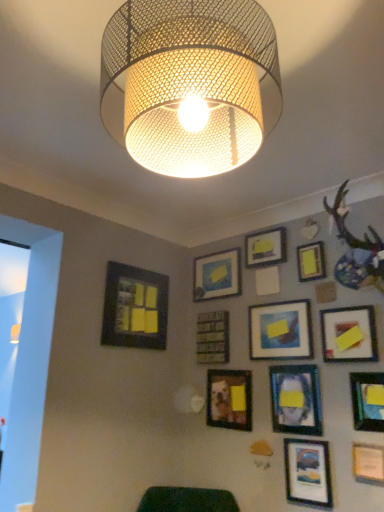
Question: Considering the relative sizes of yellow matte picture frame at upper right, acting as the 9th picture frame starting from the left, and metal mesh lampshade at upper center in the image provided, is yellow matte picture frame at upper right, acting as the 9th picture frame starting from the left, taller than metal mesh lampshade at upper center?

Choices:
 (A) yes
 (B) no

Answer: (B)

Question: Considering the relative positions of yellow matte picture frame at upper right, arranged as the fourth picture frame when viewed from the right, and metal mesh lampshade at upper center in the image provided, is yellow matte picture frame at upper right, arranged as the fourth picture frame when viewed from the right, to the left of metal mesh lampshade at upper center from the viewer's perspective?

Choices:
 (A) yes
 (B) no

Answer: (B)

Question: Is yellow matte picture frame at upper right, acting as the 9th picture frame starting from the left, completely or partially outside of metal mesh lampshade at upper center?

Choices:
 (A) yes
 (B) no

Answer: (A)

Question: Considering the relative sizes of yellow matte picture frame at upper right, acting as the 9th picture frame starting from the left, and metal mesh lampshade at upper center in the image provided, is yellow matte picture frame at upper right, acting as the 9th picture frame starting from the left, thinner than metal mesh lampshade at upper center?

Choices:
 (A) no
 (B) yes

Answer: (B)

Question: Is there a large distance between yellow matte picture frame at upper right, arranged as the fourth picture frame when viewed from the right, and metal mesh lampshade at upper center?

Choices:
 (A) no
 (B) yes

Answer: (B)

Question: From a real-world perspective, is matte black picture frame at lower left, the 1th picture frame when ordered from left to right, above or below matte black picture frame at center, which is the 4th picture frame in left-to-right order?

Choices:
 (A) above
 (B) below

Answer: (A)

Question: Based on their sizes in the image, would you say matte black picture frame at lower left, which appears as the twelfth picture frame when viewed from the right, is bigger or smaller than matte black picture frame at center, which ranks as the 9th picture frame in right-to-left order?

Choices:
 (A) small
 (B) big

Answer: (B)

Question: In the image, is matte black picture frame at lower left, which appears as the twelfth picture frame when viewed from the right, positioned in front of or behind matte black picture frame at center, which is the 4th picture frame in left-to-right order?

Choices:
 (A) front
 (B) behind

Answer: (A)

Question: From the image's perspective, is matte black picture frame at lower left, the 1th picture frame when ordered from left to right, positioned above or below matte black picture frame at center, which is the 4th picture frame in left-to-right order?

Choices:
 (A) below
 (B) above

Answer: (B)

Question: From a real-world perspective, relative to matte blue painting at center, which is the 6th picture frame in left-to-right order, is matte yellow paper at upper center, which is the tenth picture frame from right to left, vertically above or below?

Choices:
 (A) below
 (B) above

Answer: (B)

Question: Looking at their shapes, would you say matte yellow paper at upper center, which is the tenth picture frame from right to left, is wider or thinner than matte blue painting at center, the 7th picture frame viewed from the right?

Choices:
 (A) thin
 (B) wide

Answer: (A)

Question: Relative to matte blue painting at center, the 7th picture frame viewed from the right, is matte yellow paper at upper center, which is the tenth picture frame from right to left, in front or behind?

Choices:
 (A) behind
 (B) front

Answer: (A)

Question: From the image's perspective, is matte yellow paper at upper center, which is the tenth picture frame from right to left, located above or below matte blue painting at center, the 7th picture frame viewed from the right?

Choices:
 (A) above
 (B) below

Answer: (A)

Question: Considering the relative positions of yellow matte picture frame at upper center, positioned as the eighth picture frame in right-to-left order, and yellow matte picture frame at upper right, arranged as the fourth picture frame when viewed from the right, in the image provided, is yellow matte picture frame at upper center, positioned as the eighth picture frame in right-to-left order, to the left or to the right of yellow matte picture frame at upper right, arranged as the fourth picture frame when viewed from the right,?

Choices:
 (A) left
 (B) right

Answer: (A)

Question: From a real-world perspective, is yellow matte picture frame at upper center, which appears as the fifth picture frame when viewed from the left, positioned above or below yellow matte picture frame at upper right, acting as the 9th picture frame starting from the left?

Choices:
 (A) above
 (B) below

Answer: (A)